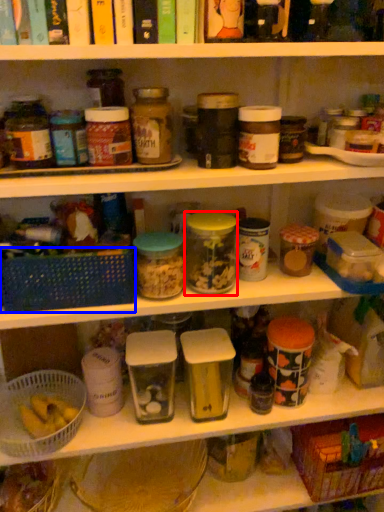
Question: Which object appears farthest to the camera in this image, glass jar (highlighted by a red box) or basket (highlighted by a blue box)?

Choices:
 (A) glass jar
 (B) basket

Answer: (A)